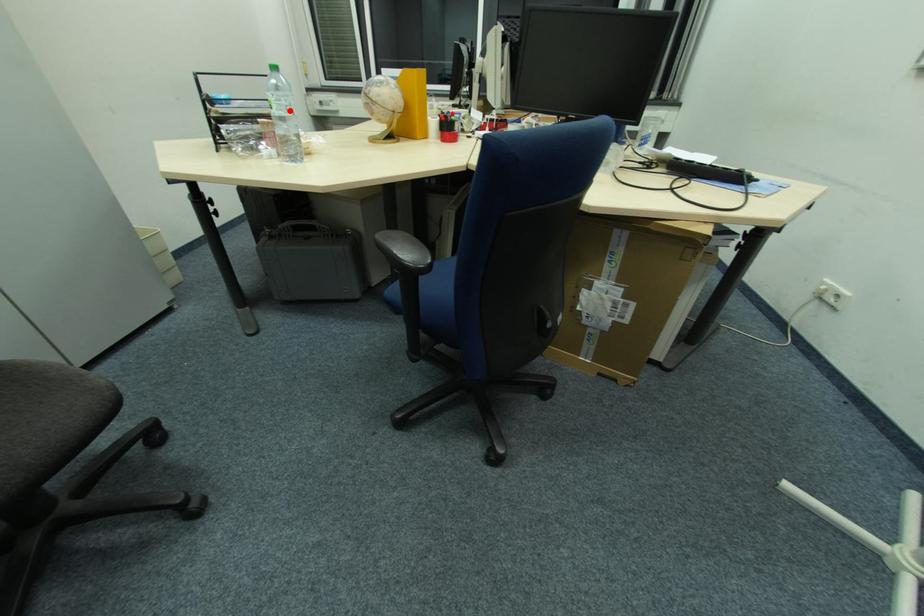
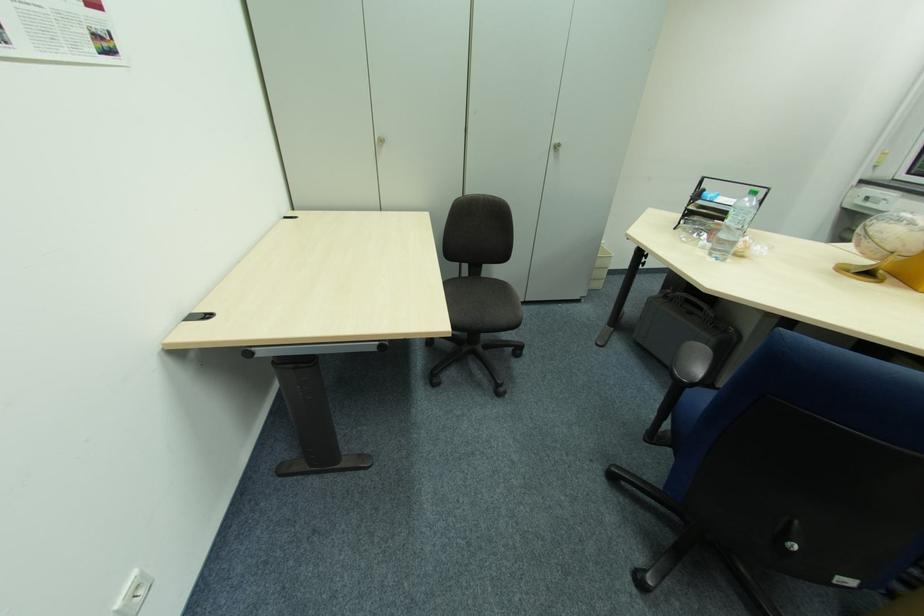
Find the pixel in the second image that matches the highlighted location in the first image.

(743, 224)